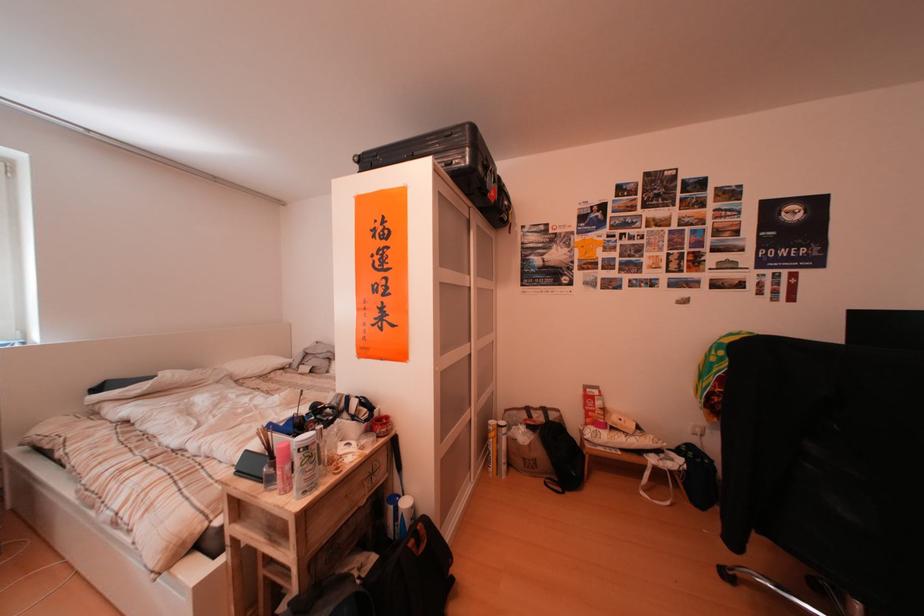
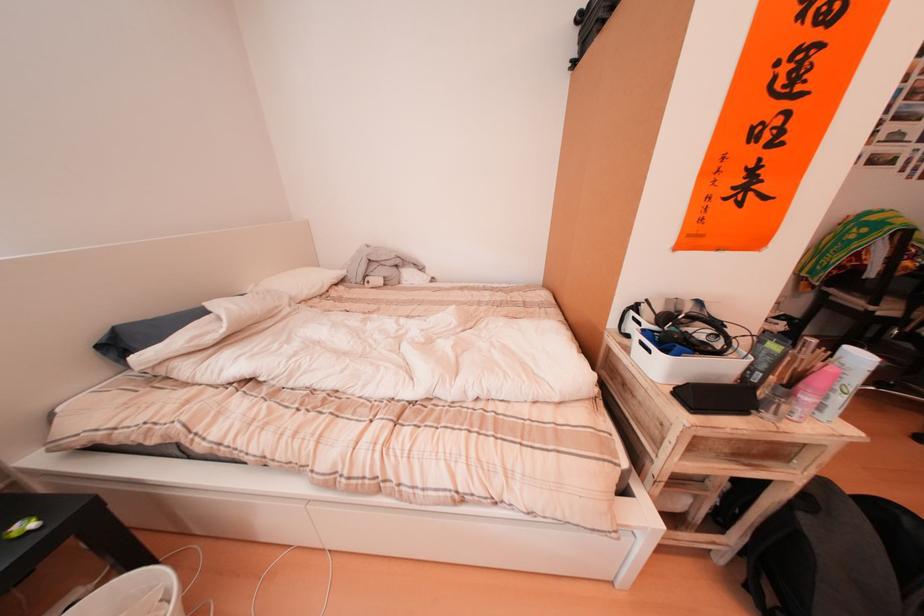
The point at (323, 362) is marked in the first image. Where is the corresponding point in the second image?

(390, 270)